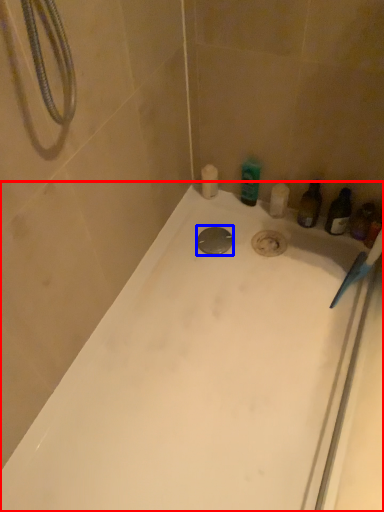
Question: Among these objects, which one is farthest to the camera, bathtub (highlighted by a red box) or drain (highlighted by a blue box)?

Choices:
 (A) bathtub
 (B) drain

Answer: (B)